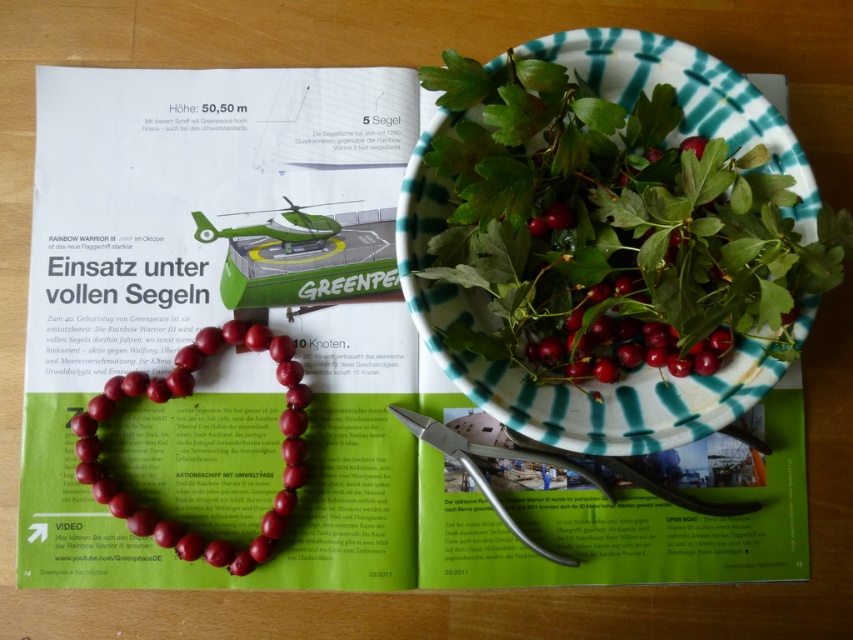
Question: Does shiny red berries at center have a lesser width compared to metallic silver scissors at center?

Choices:
 (A) no
 (B) yes

Answer: (B)

Question: Can you confirm if shiny red beads at center is thinner than metallic silver scissors at center?

Choices:
 (A) yes
 (B) no

Answer: (A)

Question: Considering the real-world distances, which object is farthest from the shiny red berries at center?

Choices:
 (A) metallic silver scissors at center
 (B) shiny red beads at center
 (C) shiny ceramic bowl at upper right

Answer: (B)

Question: Can you confirm if shiny red beads at center is thinner than metallic silver scissors at center?

Choices:
 (A) yes
 (B) no

Answer: (A)

Question: Which point is closer to the camera?

Choices:
 (A) shiny red berries at center
 (B) shiny red beads at center
 (C) metallic silver scissors at center
 (D) shiny ceramic bowl at upper right

Answer: (D)

Question: Which point is farther to the camera?

Choices:
 (A) (448, 188)
 (B) (292, 401)
 (C) (718, 326)
 (D) (520, 444)

Answer: (D)